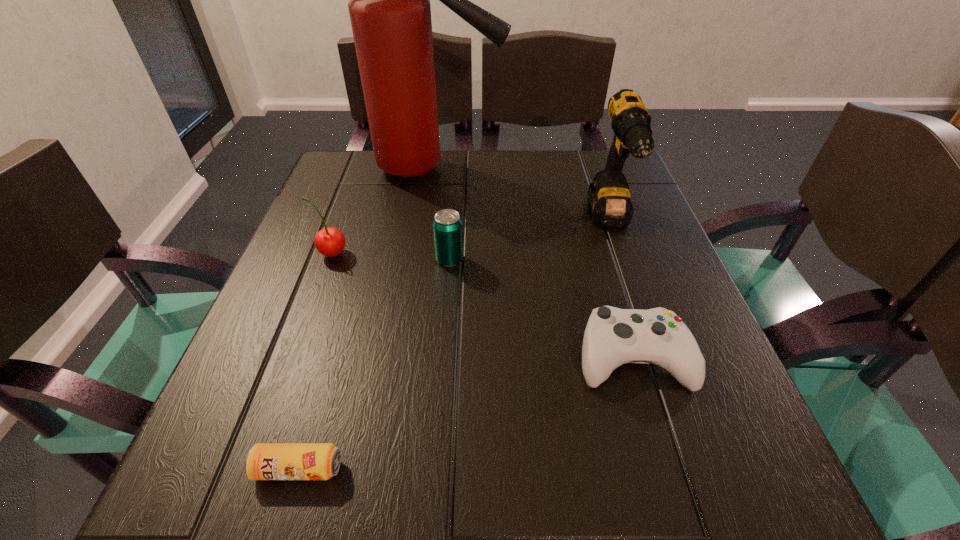
At what (x,y) coordinates should I click in order to perform the action: click on free space located at the nozzle of the farthest object. Please return your answer as a coordinate pair (x, y). Looking at the image, I should click on (577, 169).

Locate an element on the screen. The height and width of the screenshot is (540, 960). vacant region located 0.230m at the tip of the fifth shortest object is located at coordinates (655, 348).

This screenshot has height=540, width=960. Find the location of `vacant space situated on the right of the cherry`. vacant space situated on the right of the cherry is located at coordinates (419, 254).

The width and height of the screenshot is (960, 540). I want to click on free region located on the right of the right beer can, so click(x=659, y=260).

Image resolution: width=960 pixels, height=540 pixels. I want to click on vacant space located 0.280m on the back of the second shortest object, so click(x=592, y=224).

Locate an element on the screen. Image resolution: width=960 pixels, height=540 pixels. free space located 0.360m on the back of the nearest object is located at coordinates (357, 268).

The image size is (960, 540). Find the location of `fire extinguisher at the far edge`. fire extinguisher at the far edge is located at coordinates (390, 13).

Locate an element on the screen. drill present at the far edge is located at coordinates (608, 197).

Locate an element on the screen. This screenshot has height=540, width=960. object located in the near edge section of the desktop is located at coordinates (264, 461).

At what (x,y) coordinates should I click in order to perform the action: click on fire extinguisher located at the left edge. Please return your answer as a coordinate pair (x, y). Looking at the image, I should click on (390, 13).